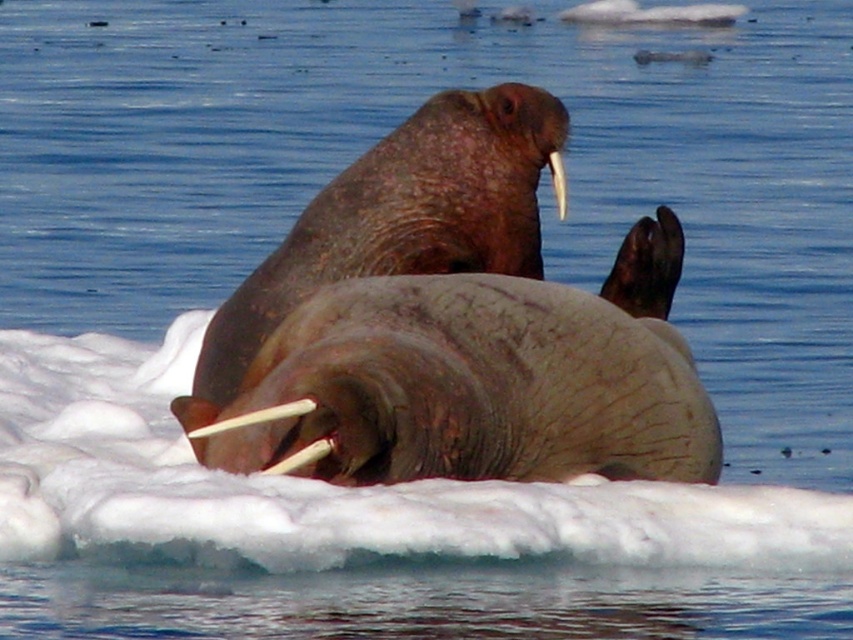
Question: Which point is farther to the camera?

Choices:
 (A) white ivory tusk at upper center
 (B) white ivory tusk at lower center
 (C) gray textured walrus at center

Answer: (A)

Question: Which of these objects is positioned farthest from the white ivory tusk at upper center?

Choices:
 (A) gray textured walrus at center
 (B) white ivory tusk at center

Answer: (B)

Question: Does gray textured walrus at center lie in front of white ivory tusk at upper center?

Choices:
 (A) no
 (B) yes

Answer: (B)

Question: Is white ivory tusk at center above white ivory tusk at lower center?

Choices:
 (A) yes
 (B) no

Answer: (A)

Question: Can you confirm if white ivory tusk at center is positioned above white ivory tusk at lower center?

Choices:
 (A) yes
 (B) no

Answer: (A)

Question: Which of the following is the closest to the observer?

Choices:
 (A) 228,422
 (B) 305,465
 (C) 552,170
 (D) 364,284

Answer: (A)